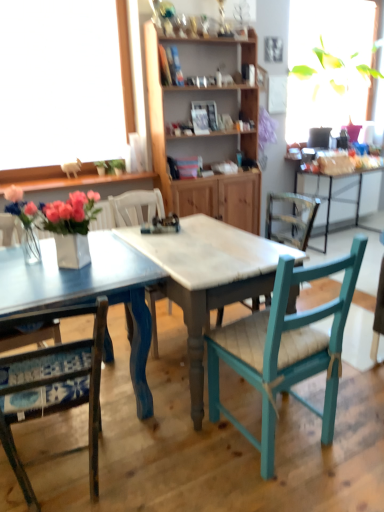
This screenshot has height=512, width=384. What are the coordinates of `vacant point above white marble table at center (from a real-world perspective)` in the screenshot? It's located at (204, 236).